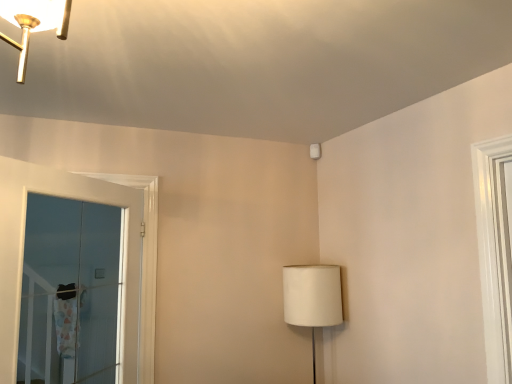
Question: Considering their positions, is transparent glass door at left located in front of or behind white fabric lampshade at lower right?

Choices:
 (A) behind
 (B) front

Answer: (B)

Question: In terms of size, does transparent glass door at left appear bigger or smaller than white fabric lampshade at lower right?

Choices:
 (A) big
 (B) small

Answer: (A)

Question: From the image's perspective, is transparent glass door at left located above or below white fabric lampshade at lower right?

Choices:
 (A) below
 (B) above

Answer: (B)

Question: In the image, is white fabric lampshade at lower right positioned in front of or behind transparent glass door at left?

Choices:
 (A) behind
 (B) front

Answer: (A)

Question: From the image's perspective, is white fabric lampshade at lower right located above or below transparent glass door at left?

Choices:
 (A) above
 (B) below

Answer: (B)

Question: Looking at their shapes, would you say white fabric lampshade at lower right is wider or thinner than transparent glass door at left?

Choices:
 (A) wide
 (B) thin

Answer: (A)

Question: Is white fabric lampshade at lower right situated inside transparent glass door at left or outside?

Choices:
 (A) inside
 (B) outside

Answer: (B)